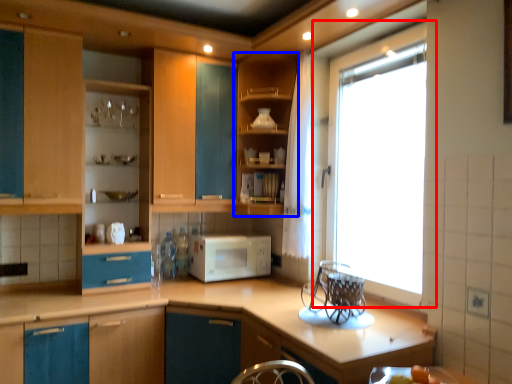
Question: Which object appears farthest to the camera in this image, window (highlighted by a red box) or cabinetry (highlighted by a blue box)?

Choices:
 (A) window
 (B) cabinetry

Answer: (B)